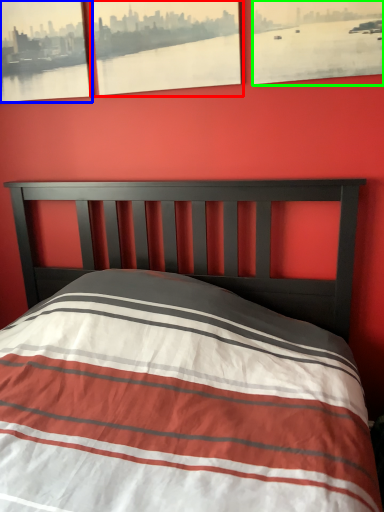
Question: Which is nearer to the picture frame (highlighted by a red box)? picture frame (highlighted by a blue box) or picture frame (highlighted by a green box).

Choices:
 (A) picture frame
 (B) picture frame

Answer: (A)